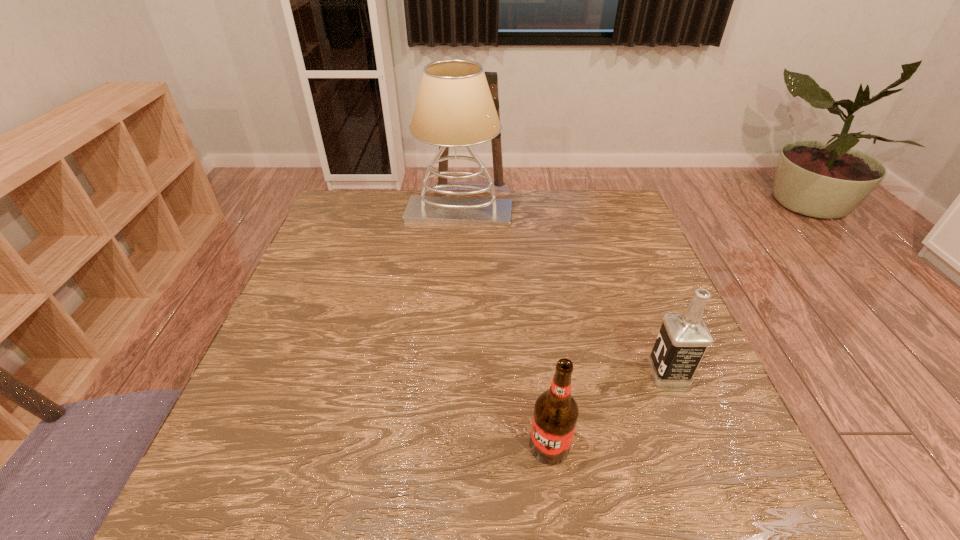
The width and height of the screenshot is (960, 540). What are the coordinates of `table lamp` in the screenshot? It's located at (454, 108).

This screenshot has height=540, width=960. In order to click on the tallest object in this screenshot , I will do `click(454, 108)`.

Locate an element on the screen. root beer is located at coordinates (556, 412).

Identify the location of the rightmost object. (683, 339).

Find the location of a particular element. Image resolution: width=960 pixels, height=540 pixels. the second farthest object is located at coordinates (683, 339).

This screenshot has width=960, height=540. I want to click on vacant space located on the right of the table lamp, so click(x=579, y=213).

This screenshot has height=540, width=960. I want to click on vacant region located 0.320m on the back of the nearest object, so click(532, 308).

Locate an element on the screen. free spot located on the front label of the second farthest object is located at coordinates (565, 372).

Identify the location of vacant space located on the front label of the second farthest object. (556, 372).

This screenshot has height=540, width=960. I want to click on free space located 0.390m on the front label of the second farthest object, so [x=466, y=372].